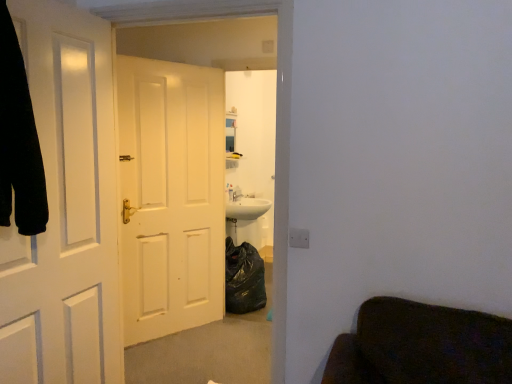
Where is `free space in front of white matte door at center, which is the 2th door in front-to-back order`? The image size is (512, 384). free space in front of white matte door at center, which is the 2th door in front-to-back order is located at coordinates (180, 363).